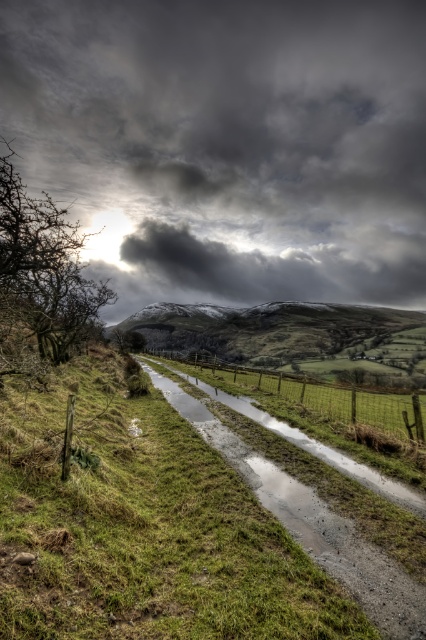
Who is more distant from viewer, (399, 320) or (391, 579)?

The point (399, 320) is behind.

Is point (397, 362) more distant than point (255, 476)?

Yes, point (397, 362) is farther from viewer.

The width and height of the screenshot is (426, 640). In order to click on green grassy hillside at center in this screenshot , I will do `click(294, 339)`.

Who is lower down, dark gray cloud at upper center or gray gravel stream at center?

Positioned lower is gray gravel stream at center.

Which is above, dark gray cloud at upper center or gray gravel stream at center?

Positioned higher is dark gray cloud at upper center.

This screenshot has width=426, height=640. What do you see at coordinates (227, 141) in the screenshot? I see `dark gray cloud at upper center` at bounding box center [227, 141].

Where is `dark gray cloud at upper center`? Image resolution: width=426 pixels, height=640 pixels. dark gray cloud at upper center is located at coordinates (x=227, y=141).

Between green grassy hillside at center and wooden fence at center, which one is positioned higher?

green grassy hillside at center

Is green grassy hillside at center bigger than wooden fence at center?

Yes, green grassy hillside at center is bigger than wooden fence at center.

Where is `green grassy hillside at center`? green grassy hillside at center is located at coordinates (294, 339).